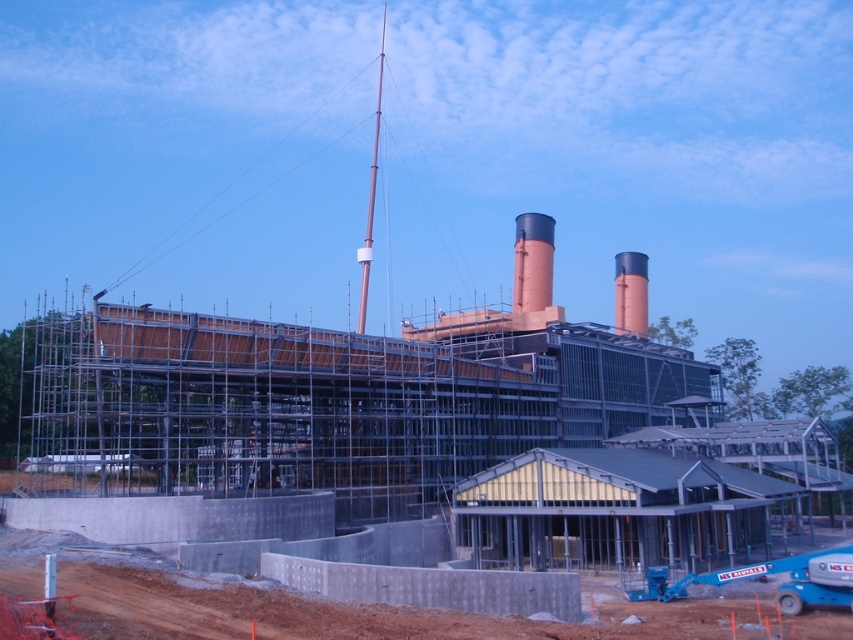
You are a construction worker who needs to move a heavy beam from the metal scaffolding at center to the brown dirt track at lower left. Which direction should you move the beam to reach the track?

The metal scaffolding at center is positioned on the left side of the brown dirt track at lower left, so you should move the beam to the right to reach the track.

You are a construction worker standing at the entrance of the building. You need to move a heavy beam from the metal scaffolding at center to the rustic brick chimney at center. The beam is 80 feet long. Can you safely transport it horizontally between these two points without bending or breaking the beam?

The distance between the metal scaffolding at center and the rustic brick chimney at center is 76.97 feet. Since the beam is 80 feet long, it is longer than the distance between them. Therefore, you can safely transport it horizontally as the beam will have enough length to span the gap without needing to bend or break it.

You are a construction worker standing at the base of the building looking up. There are two points marked on the building facade. Which point, point (x=546, y=284) or point (x=624, y=330), is closer to you?

Point (x=546, y=284) is closer to the viewer than point (x=624, y=330).